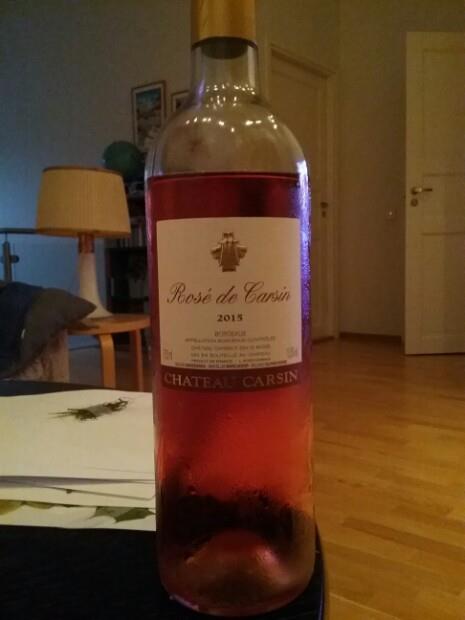
Identify the location of light wood floor. The width and height of the screenshot is (465, 620). (390, 572), (407, 469), (365, 381), (436, 394).